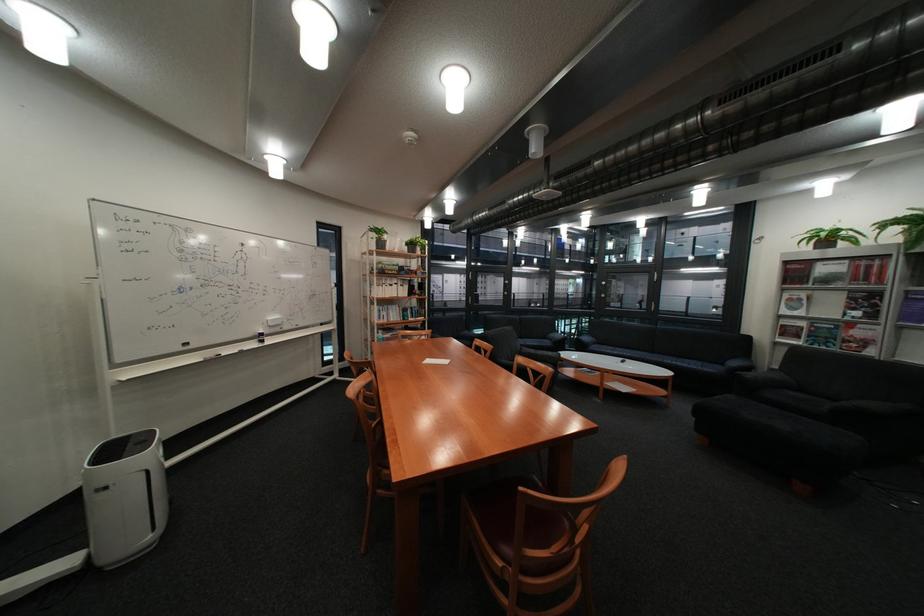
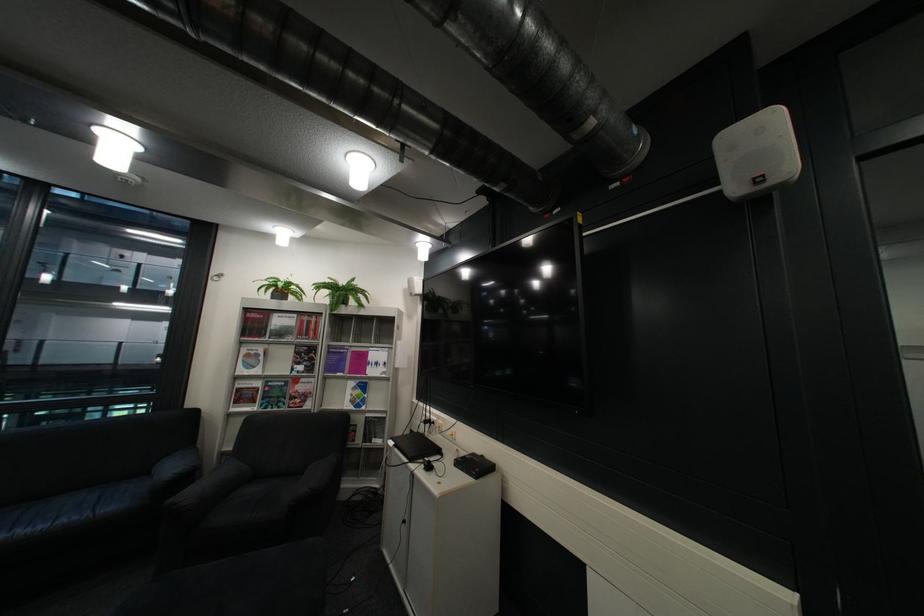
In the second image, find the point that corresponds to (x=839, y=334) in the first image.

(290, 394)